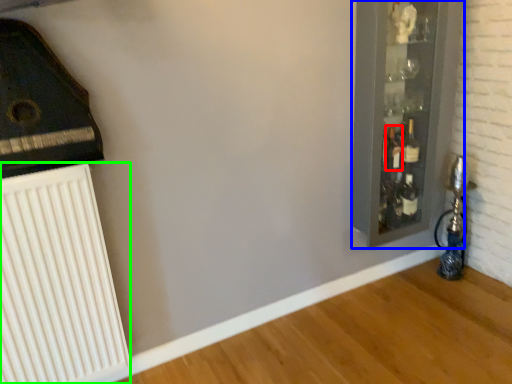
Question: Which object is the closest to the bottle (highlighted by a red box)? Choose among these: glass door (highlighted by a blue box) or radiator (highlighted by a green box).

Choices:
 (A) glass door
 (B) radiator

Answer: (A)